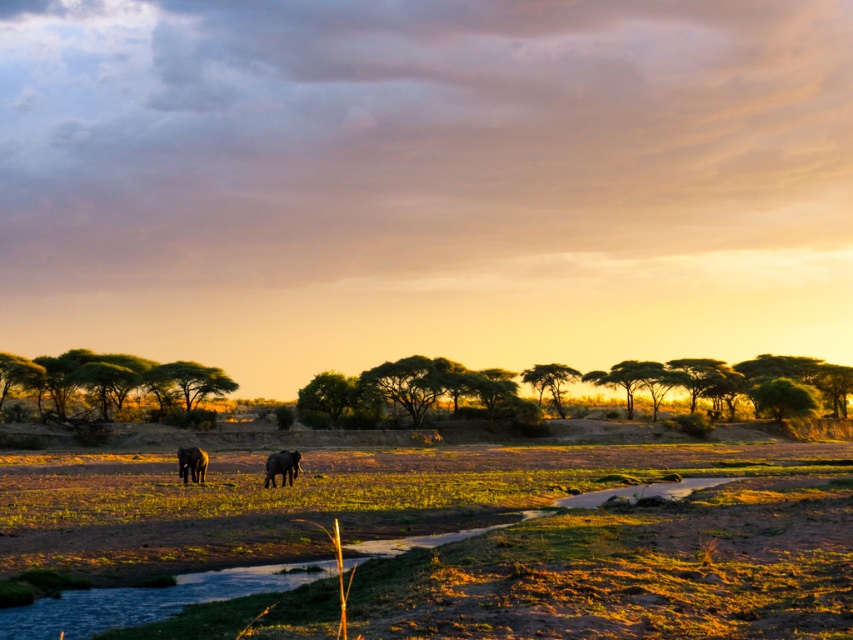
You are standing at the origin point in the African savanna scene. The dark gray textured elephant at center is at coordinates 0.730, 0.331. If you want to walk directly towards the elephant, which direction should you head?

The dark gray textured elephant at center is located at coordinates (281,467). Since the x and y coordinates are both positive, you should head northeast to reach it.

In the scene shown: Please look at the image of the African savanna. There is a point marked at coordinate (281,467). What object is located at that point?

The point at coordinate (281,467) marks the location of the dark gray textured elephant at center.